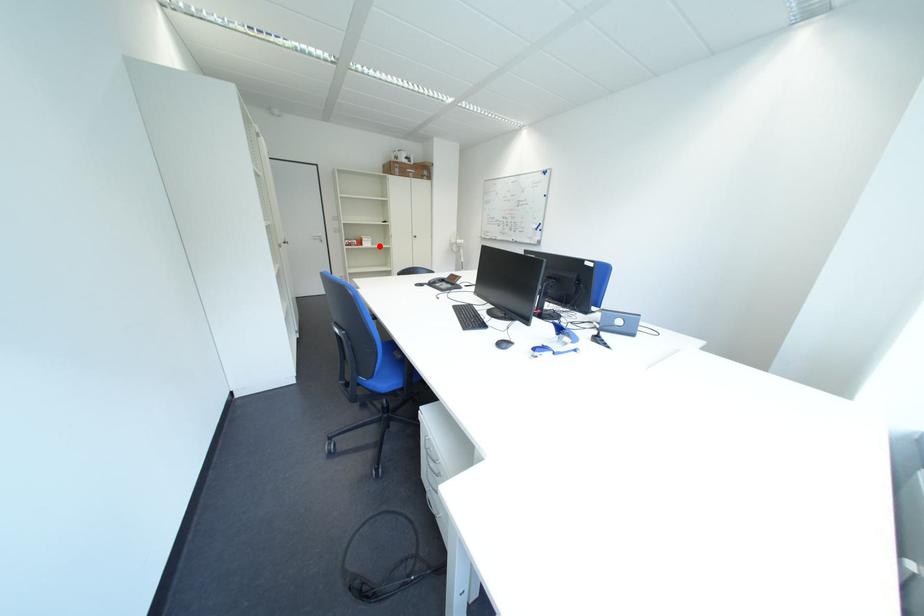
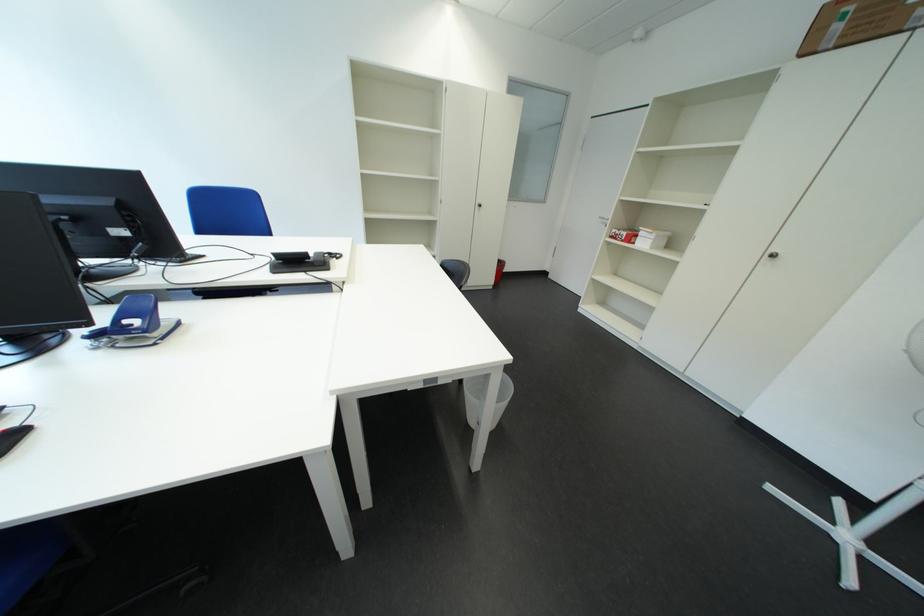
Question: I am providing you with two images of the same scene from different viewpoints. In image1, a red point is highlighted. Considering the same 3D point in image2, which of the following is correct?

Choices:
 (A) It is closer
 (B) It is farther

Answer: (B)